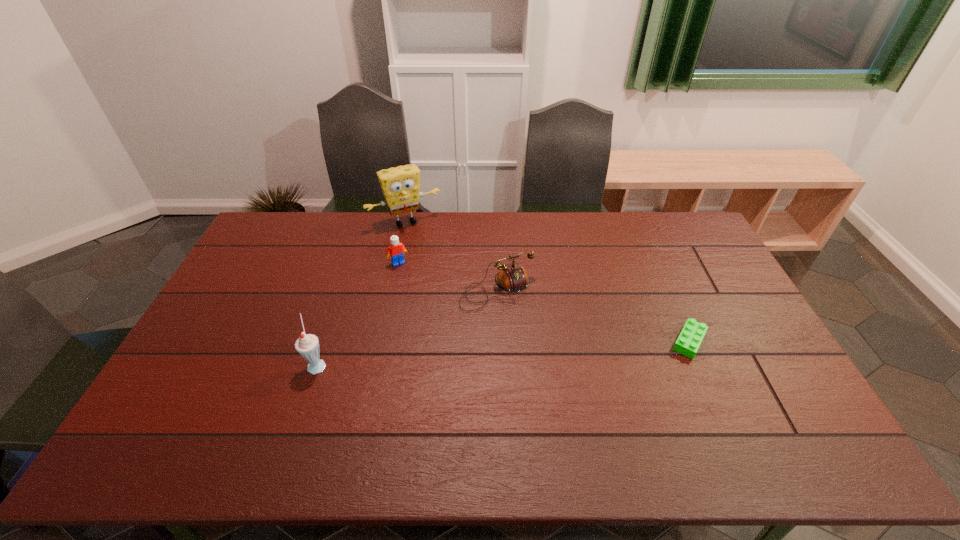
Find the location of a particular element. This screenshot has width=960, height=540. unoccupied area between the second farthest object and the third farthest object is located at coordinates (447, 276).

Identify the location of empty space that is in between the farthest object and the fourth object from left to right. (451, 255).

I want to click on free space that is in between the third nearest object and the second tallest object, so click(407, 327).

Identify the location of vacant space in between the left Lego and the farthest object. The image size is (960, 540). (402, 242).

Identify the location of unoccupied area between the fourth shortest object and the rightmost object. Image resolution: width=960 pixels, height=540 pixels. (503, 353).

The image size is (960, 540). In order to click on free space between the third farthest object and the fourth nearest object in this screenshot , I will do `click(447, 276)`.

At what (x,y) coordinates should I click in order to perform the action: click on blank region between the fourth nearest object and the right Lego. Please return your answer as a coordinate pair (x, y). Looking at the image, I should click on (543, 302).

Identify which object is located as the nearest to the right Lego. Please provide its 2D coordinates. Your answer should be formatted as a tuple, i.e. [(x, y)], where the tuple contains the x and y coordinates of a point satisfying the conditions above.

[(512, 278)]

You are a GUI agent. You are given a task and a screenshot of the screen. Output one action in this format:
    pyautogui.click(x=<x>, y=<y>)
    Task: Click on the closest object to the sponge
    Image resolution: width=960 pixels, height=540 pixels.
    Given the screenshot: What is the action you would take?
    pyautogui.click(x=395, y=251)